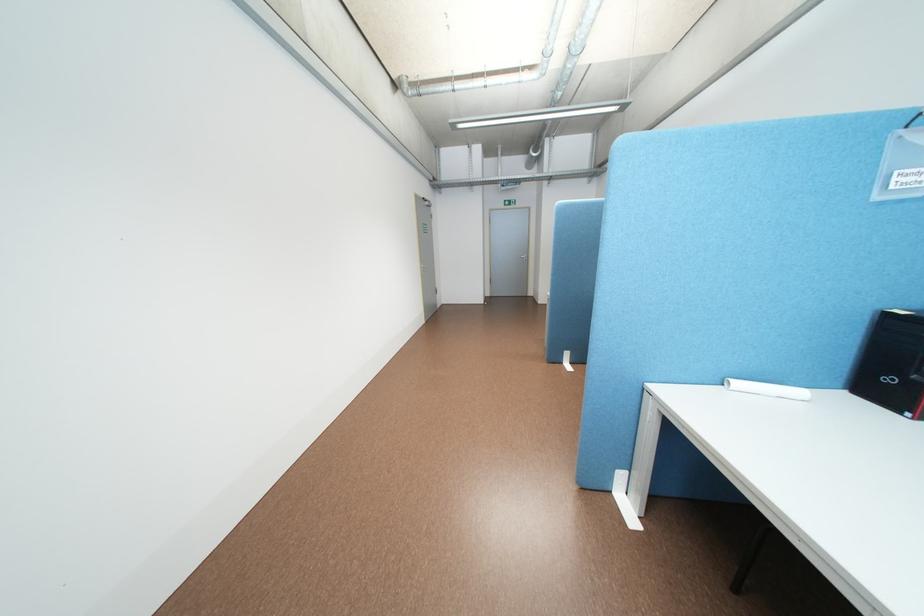
What do you see at coordinates (507, 252) in the screenshot? This screenshot has width=924, height=616. I see `a grey door handle` at bounding box center [507, 252].